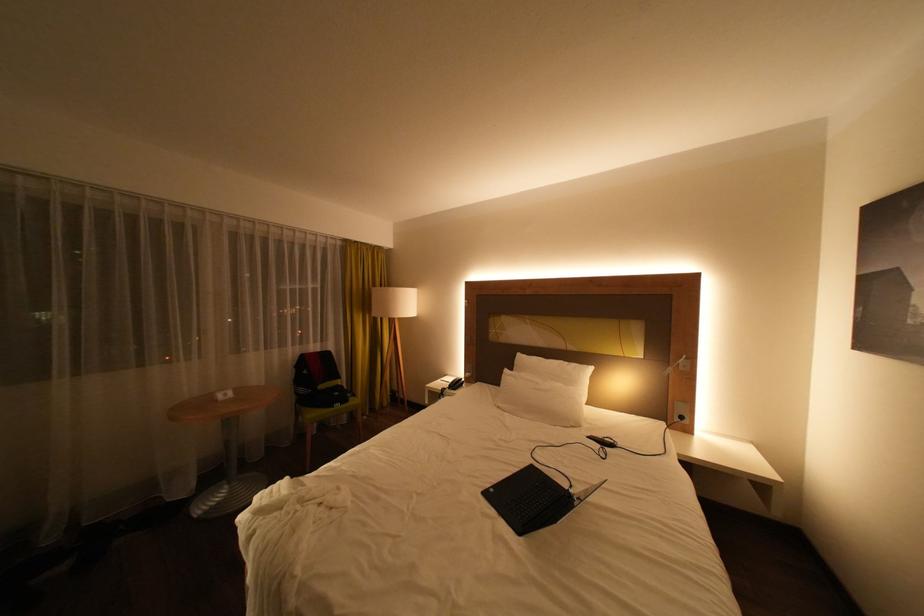
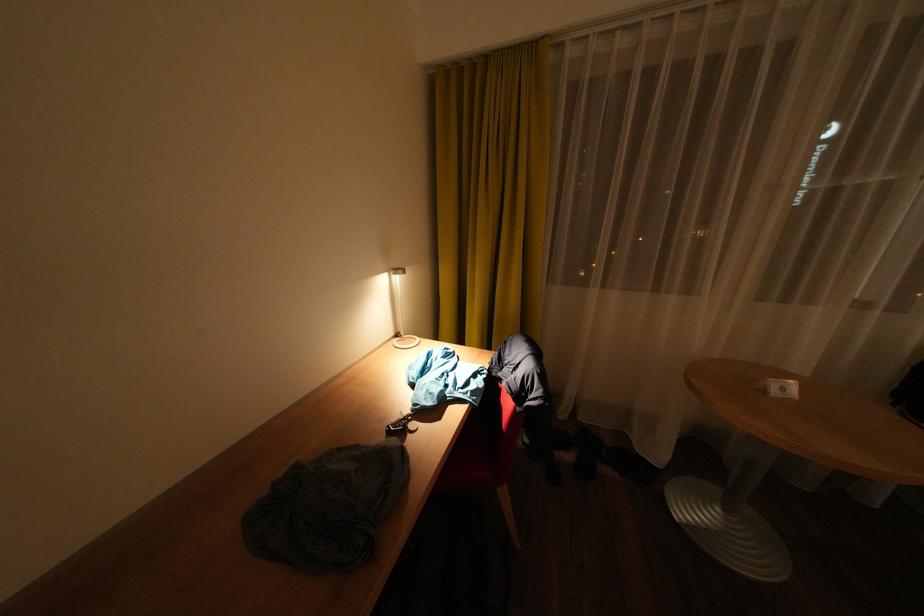
Find the pixel in the second image that matches (237,395) in the first image.

(794, 390)